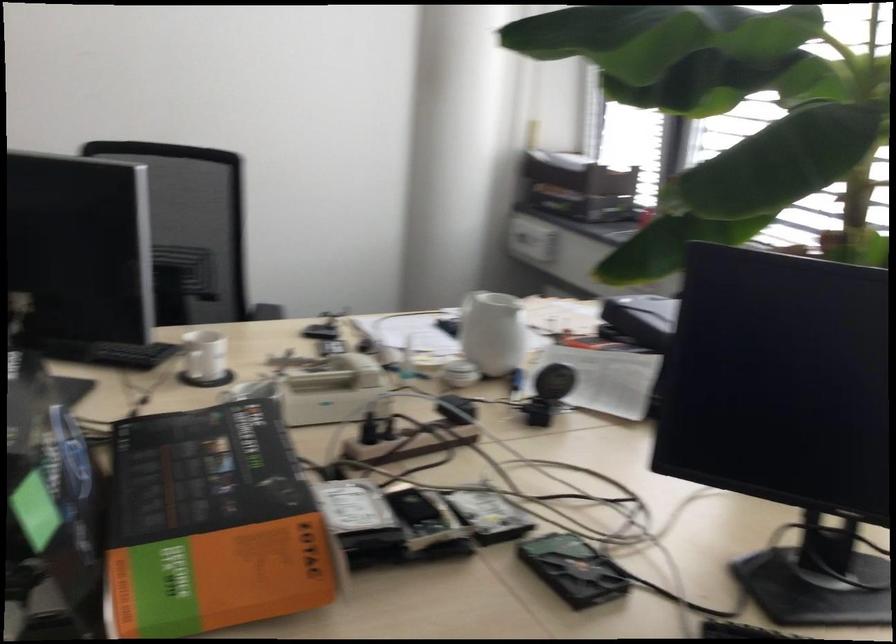
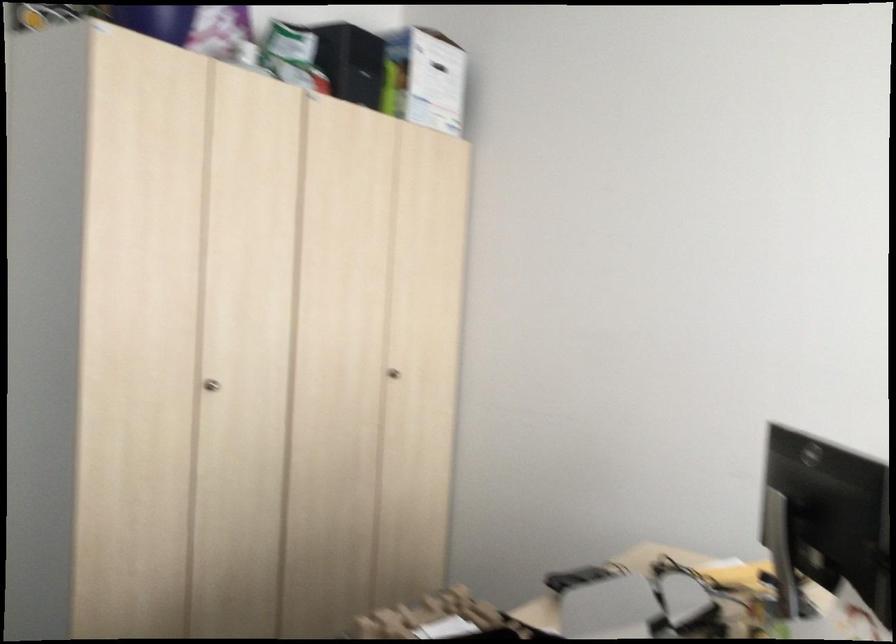
Question: The camera is either moving clockwise (left) or counter-clockwise (right) around the object. The first image is from the beginning of the video and the second image is from the end. Is the camera moving left or right when shooting the video?

Choices:
 (A) Left
 (B) Right

Answer: (B)